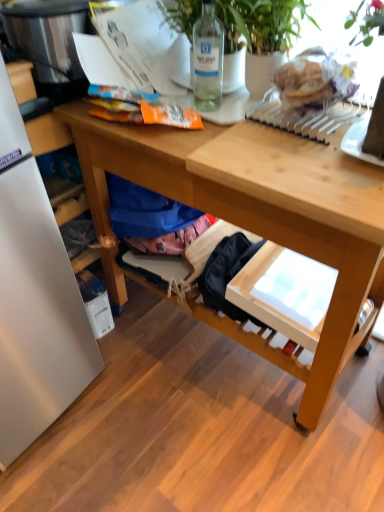
What is the approximate height of stainless steel appliance at left?

stainless steel appliance at left is 9.51 inches tall.

The height and width of the screenshot is (512, 384). What do you see at coordinates (256, 212) in the screenshot?
I see `wooden desk at center` at bounding box center [256, 212].

Image resolution: width=384 pixels, height=512 pixels. Describe the element at coordinates (261, 26) in the screenshot. I see `green leafy plant at upper right` at that location.

I want to click on clear glass bottle at upper center, so (x=208, y=59).

Is wooden desk at center with clear glass bottle at upper center?

No, wooden desk at center is not touching clear glass bottle at upper center.

In the scene shown: Between wooden desk at center and clear glass bottle at upper center, which one has more height?

With more height is wooden desk at center.

Can you confirm if wooden desk at center is thinner than clear glass bottle at upper center?

In fact, wooden desk at center might be wider than clear glass bottle at upper center.

The height and width of the screenshot is (512, 384). What are the coordinates of `bottle located above the wooden desk at center (from the image's perspective)` in the screenshot? It's located at (208, 59).

Would you say clear glass bottle at upper center contains stainless steel appliance at left?

Definitely not — stainless steel appliance at left is not inside clear glass bottle at upper center.

Is clear glass bottle at upper center to the right of stainless steel appliance at left from the viewer's perspective?

Indeed, clear glass bottle at upper center is positioned on the right side of stainless steel appliance at left.

Is clear glass bottle at upper center taller than stainless steel appliance at left?

Yes, clear glass bottle at upper center is taller than stainless steel appliance at left.

Who is bigger, clear glass bottle at upper center or stainless steel appliance at left?

stainless steel appliance at left.

From the image's perspective, is green leafy plant at upper right on top of stainless steel appliance at left?

No, from the image's perspective, green leafy plant at upper right is not on top of stainless steel appliance at left.

Would you say green leafy plant at upper right is a long distance from stainless steel appliance at left?

That's not correct — green leafy plant at upper right is a little close to stainless steel appliance at left.

Which of these two, green leafy plant at upper right or stainless steel appliance at left, is thinner?

Thinner between the two is stainless steel appliance at left.

Which object is thinner, green leafy plant at upper right or wooden desk at center?

Thinner between the two is green leafy plant at upper right.

At what (x,y) coordinates should I click in order to perform the action: click on desk that appears below the green leafy plant at upper right (from the image's perspective). Please return your answer as a coordinate pair (x, y). The image size is (384, 512). Looking at the image, I should click on (256, 212).

Which of these two, green leafy plant at upper right or wooden desk at center, is smaller?

green leafy plant at upper right is smaller.

Can wooden desk at center be found inside green leafy plant at upper right?

No.

From a real-world perspective, is stainless steel appliance at left located higher than green leafy plant at upper right?

Yes.

Can you tell me how much stainless steel appliance at left and green leafy plant at upper right differ in facing direction?

They differ by 85.3 degrees in their facing directions.

Is stainless steel appliance at left at the right side of green leafy plant at upper right?

Incorrect, stainless steel appliance at left is not on the right side of green leafy plant at upper right.

Which object is closer to the camera taking this photo, stainless steel appliance at left or green leafy plant at upper right?

green leafy plant at upper right is more forward.

Is clear glass bottle at upper center directly adjacent to green leafy plant at upper right?

Yes.

Is clear glass bottle at upper center not within green leafy plant at upper right?

That's incorrect, clear glass bottle at upper center is not completely outside green leafy plant at upper right.

The height and width of the screenshot is (512, 384). Find the location of `bottle on the left side of green leafy plant at upper right`. bottle on the left side of green leafy plant at upper right is located at coordinates (208, 59).

Considering the positions of points (193, 66) and (283, 46), is point (193, 66) closer to camera compared to point (283, 46)?

No, it is not.

Would you consider clear glass bottle at upper center to be distant from wooden desk at center?

clear glass bottle at upper center is near wooden desk at center, not far away.

From the image's perspective, is clear glass bottle at upper center located above wooden desk at center?

Indeed, from the image's perspective, clear glass bottle at upper center is shown above wooden desk at center.

How different are the orientations of clear glass bottle at upper center and wooden desk at center in degrees?

clear glass bottle at upper center and wooden desk at center are facing 8.04 degrees away from each other.

I want to click on bottle on the left of wooden desk at center, so click(208, 59).

Locate an element on the screen. This screenshot has width=384, height=512. bottle in front of the stainless steel appliance at left is located at coordinates (208, 59).

Based on their spatial positions, is wooden desk at center or stainless steel appliance at left closer to green leafy plant at upper right?

stainless steel appliance at left.

Estimate the real-world distances between objects in this image. Which object is closer to wooden desk at center, stainless steel appliance at left or clear glass bottle at upper center?

clear glass bottle at upper center is positioned closer to the anchor wooden desk at center.

Estimate the real-world distances between objects in this image. Which object is closer to green leafy plant at upper right, clear glass bottle at upper center or wooden desk at center?

clear glass bottle at upper center is closer to green leafy plant at upper right.

Which object lies further to the anchor point clear glass bottle at upper center, stainless steel appliance at left or green leafy plant at upper right?

stainless steel appliance at left.

Based on their spatial positions, is wooden desk at center or green leafy plant at upper right closer to clear glass bottle at upper center?

Based on the image, green leafy plant at upper right appears to be nearer to clear glass bottle at upper center.

From the image, which object appears to be farther from stainless steel appliance at left, clear glass bottle at upper center or wooden desk at center?

wooden desk at center is further to stainless steel appliance at left.

Estimate the real-world distances between objects in this image. Which object is closer to stainless steel appliance at left, green leafy plant at upper right or clear glass bottle at upper center?

Among the two, clear glass bottle at upper center is located nearer to stainless steel appliance at left.

From the picture: Estimate the real-world distances between objects in this image. Which object is closer to stainless steel appliance at left, wooden desk at center or clear glass bottle at upper center?

clear glass bottle at upper center lies closer to stainless steel appliance at left than the other object.

You are a GUI agent. You are given a task and a screenshot of the screen. Output one action in this format:
    pyautogui.click(x=<x>, y=<y>)
    Task: Click on the bottle between green leafy plant at upper right and wooden desk at center from top to bottom
    Image resolution: width=384 pixels, height=512 pixels.
    Given the screenshot: What is the action you would take?
    pyautogui.click(x=208, y=59)

Find the location of a particular element. bottle between stainless steel appliance at left and wooden desk at center in the vertical direction is located at coordinates (208, 59).

The image size is (384, 512). In order to click on bottle located between stainless steel appliance at left and green leafy plant at upper right in the left-right direction in this screenshot , I will do `click(208, 59)`.

The width and height of the screenshot is (384, 512). What are the coordinates of `desk located between stainless steel appliance at left and green leafy plant at upper right in the left-right direction` in the screenshot? It's located at (256, 212).